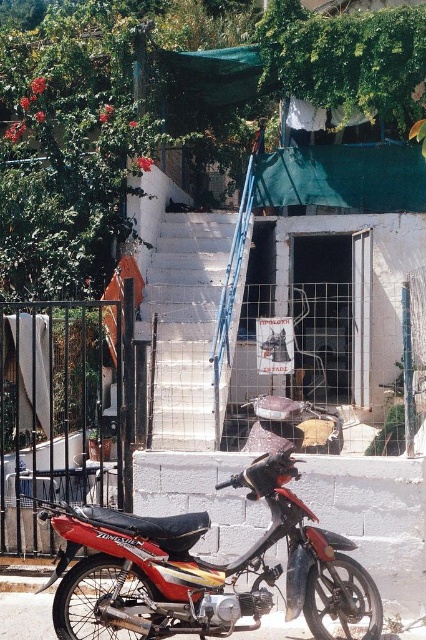
Question: Is shiny red motorcycle at lower left bigger than black metal fence at left?

Choices:
 (A) no
 (B) yes

Answer: (A)

Question: Among these points, which one is farthest from the camera?

Choices:
 (A) (161, 339)
 (B) (259, 550)

Answer: (A)

Question: Can you confirm if black metal fence at left is thinner than white concrete stairs at center?

Choices:
 (A) yes
 (B) no

Answer: (B)

Question: From the image, what is the correct spatial relationship of shiny red motorcycle at lower left in relation to white concrete stairs at center?

Choices:
 (A) above
 (B) below

Answer: (B)

Question: Which point is farther to the camera?

Choices:
 (A) (34, 500)
 (B) (235, 212)
 (C) (222, 605)

Answer: (B)

Question: Which point appears closest to the camera in this image?

Choices:
 (A) (183, 614)
 (B) (34, 346)

Answer: (A)